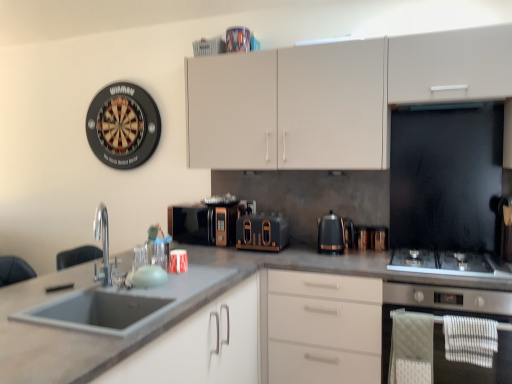
Question: Is black metallic kettle at center spatially inside matte white cabinets at upper center, arranged as the second cabinetry when ordered from the bottom, or outside of it?

Choices:
 (A) outside
 (B) inside

Answer: (A)

Question: Is black metallic kettle at center bigger or smaller than matte white cabinets at upper center, the first cabinetry viewed from the top?

Choices:
 (A) big
 (B) small

Answer: (B)

Question: Considering the real-world distances, which object is farthest from the stainless steel oven at lower right?

Choices:
 (A) matte white cabinets at upper center, placed as the second cabinetry when sorted from left to right
 (B) black metallic kettle at center
 (C) matte black coffee machine at center
 (D) polished chrome faucet at sink left
 (E) matte gray sink at lower left, which is the second cabinetry from top to bottom

Answer: (D)

Question: Which is nearer to the matte white cabinets at upper center, arranged as the second cabinetry when ordered from the bottom?

Choices:
 (A) metallic silver kettle at center, arranged as the 2th appliance when viewed from the left
 (B) black metallic kettle at center
 (C) matte black toaster at center, the 1th appliance viewed from the left
 (D) stainless steel gas stove at right
 (E) gray matte countertop at center

Answer: (C)